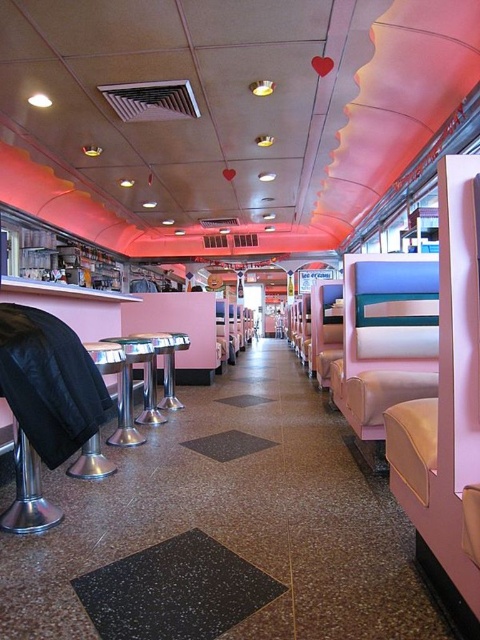
Question: Is black leather stool at lower left to the right of metallic silver table at center from the viewer's perspective?

Choices:
 (A) yes
 (B) no

Answer: (A)

Question: Can you confirm if metallic silver table at lower left is wider than silver metallic bar stool at center?

Choices:
 (A) no
 (B) yes

Answer: (A)

Question: Which object is positioned closest to the silver metallic bar stool at center?

Choices:
 (A) metallic silver table at lower left
 (B) black leather stool at lower left
 (C) metallic silver table at center

Answer: (C)

Question: Which of the following is the closest to the observer?

Choices:
 (A) black leather stool at lower left
 (B) silver metallic bar stool at center
 (C) metallic silver table at center
 (D) metallic silver table at lower left

Answer: (A)

Question: Is black leather stool at lower left wider than metallic silver table at lower left?

Choices:
 (A) no
 (B) yes

Answer: (B)

Question: Which point appears farthest from the camera in this image?

Choices:
 (A) (145, 412)
 (B) (130, 381)
 (C) (96, 468)

Answer: (A)